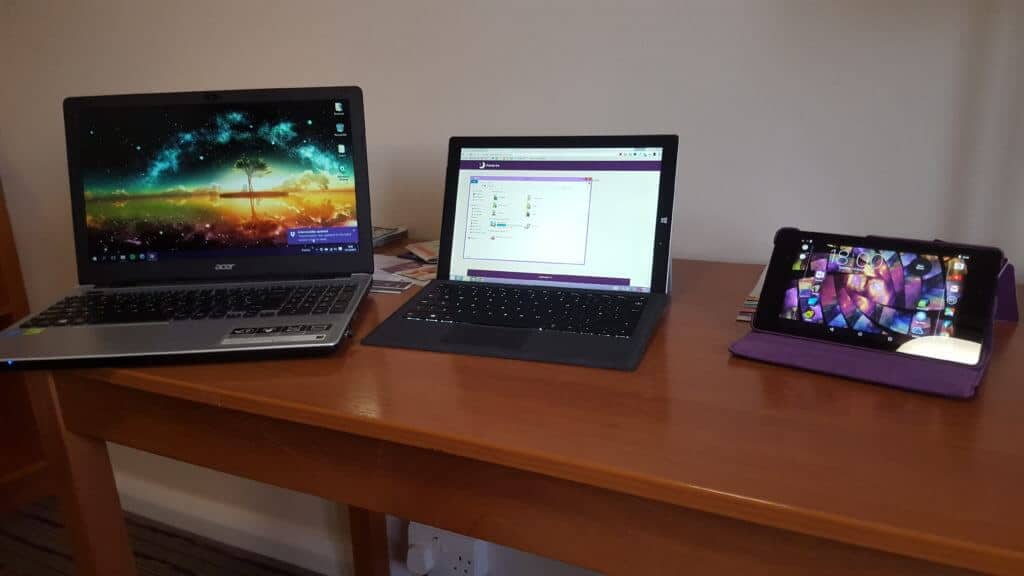
The width and height of the screenshot is (1024, 576). I want to click on desk or table surface, so pos(481,435).